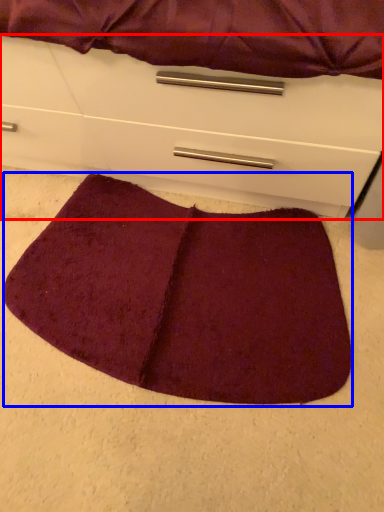
Question: Among these objects, which one is farthest to the camera, chest of drawers (highlighted by a red box) or mat (highlighted by a blue box)?

Choices:
 (A) chest of drawers
 (B) mat

Answer: (B)